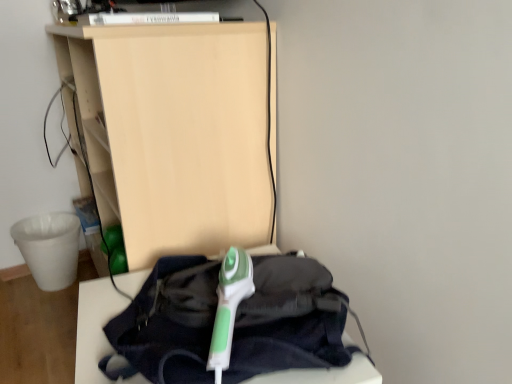
Find the location of a particular element. vacant area situated to the left side of green plastic iron at center is located at coordinates (114, 324).